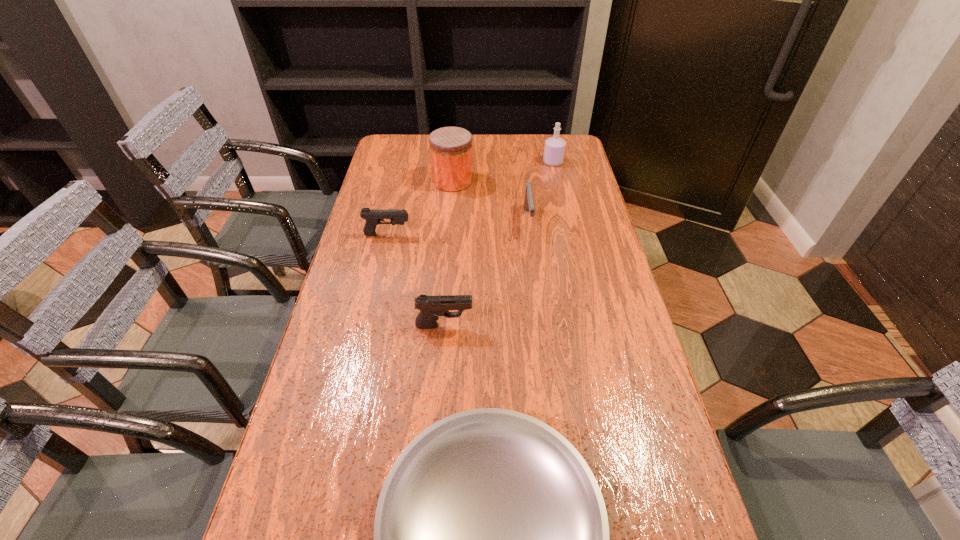
Locate an element on the screen. This screenshot has width=960, height=540. the second farthest object is located at coordinates (450, 147).

You are a GUI agent. You are given a task and a screenshot of the screen. Output one action in this format:
    pyautogui.click(x=<x>, y=<y>)
    Task: Click on the rightmost object
    This screenshot has width=960, height=540.
    Given the screenshot: What is the action you would take?
    pyautogui.click(x=554, y=150)

I want to click on perfume, so click(x=554, y=150).

This screenshot has width=960, height=540. In order to click on the rightmost pistol in this screenshot , I will do `click(529, 205)`.

In order to click on the second pistol from left to right in this screenshot , I will do `click(430, 307)`.

Identify the location of the nearest pistol. This screenshot has height=540, width=960. (430, 307).

Locate an element on the screen. the leftmost object is located at coordinates (373, 217).

You are a GUI agent. You are given a task and a screenshot of the screen. Output one action in this format:
    pyautogui.click(x=<x>, y=<y>)
    Task: Click on the vacant point located 0.130m on the front of the jar
    The width and height of the screenshot is (960, 540).
    Given the screenshot: What is the action you would take?
    pyautogui.click(x=450, y=214)

Identify the location of blank space located on the front of the farthest object. (568, 233).

This screenshot has width=960, height=540. I want to click on vacant region located 0.290m at the barrel of the rightmost pistol, so click(x=539, y=307).